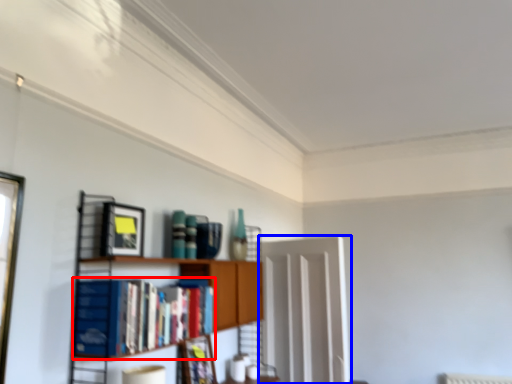
Question: Which object is closer to the camera taking this photo, book (highlighted by a red box) or glass door (highlighted by a blue box)?

Choices:
 (A) book
 (B) glass door

Answer: (A)